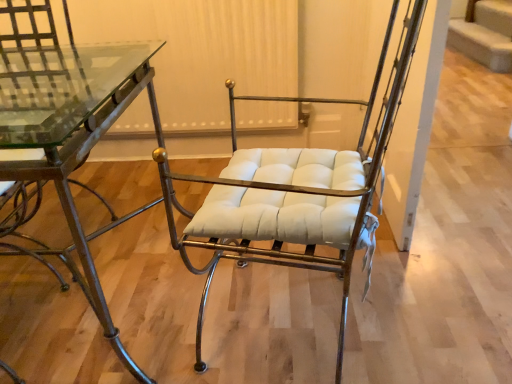
Question: From the image's perspective, is metallic glass table at left beneath white leather chair at center?

Choices:
 (A) no
 (B) yes

Answer: (B)

Question: Considering the relative sizes of metallic glass table at left and white leather chair at center in the image provided, is metallic glass table at left bigger than white leather chair at center?

Choices:
 (A) no
 (B) yes

Answer: (B)

Question: Does metallic glass table at left come in front of white leather chair at center?

Choices:
 (A) yes
 (B) no

Answer: (B)

Question: Can you confirm if metallic glass table at left is wider than white leather chair at center?

Choices:
 (A) yes
 (B) no

Answer: (A)

Question: Is metallic glass table at left oriented towards white leather chair at center?

Choices:
 (A) no
 (B) yes

Answer: (A)

Question: Is metallic glass table at left at the right side of white leather chair at center?

Choices:
 (A) no
 (B) yes

Answer: (A)

Question: Is white leather chair at center facing towards metallic glass table at left?

Choices:
 (A) no
 (B) yes

Answer: (A)

Question: Is white leather chair at center positioned with its back to metallic glass table at left?

Choices:
 (A) no
 (B) yes

Answer: (A)

Question: Is white leather chair at center completely or partially outside of metallic glass table at left?

Choices:
 (A) yes
 (B) no

Answer: (A)

Question: From the image's perspective, is white leather chair at center beneath metallic glass table at left?

Choices:
 (A) yes
 (B) no

Answer: (B)

Question: Is white leather chair at center closer to camera compared to metallic glass table at left?

Choices:
 (A) yes
 (B) no

Answer: (A)

Question: Can you confirm if white leather chair at center is taller than metallic glass table at left?

Choices:
 (A) yes
 (B) no

Answer: (A)

Question: Is point (83, 107) closer or farther from the camera than point (282, 175)?

Choices:
 (A) farther
 (B) closer

Answer: (A)